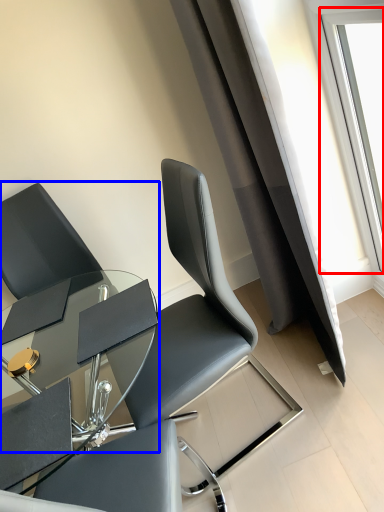
Question: Which of the following is the closest to the observer, window (highlighted by a red box) or chair (highlighted by a blue box)?

Choices:
 (A) window
 (B) chair

Answer: (A)